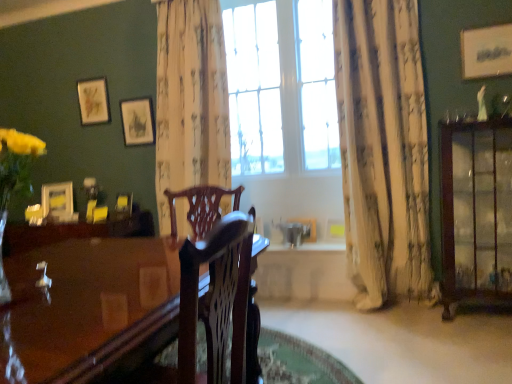
Locate an element on the screen. The width and height of the screenshot is (512, 384). free region on the left part of yellow paper picture frame at center, the 2th picture frame when ordered from bottom to top is located at coordinates (314, 243).